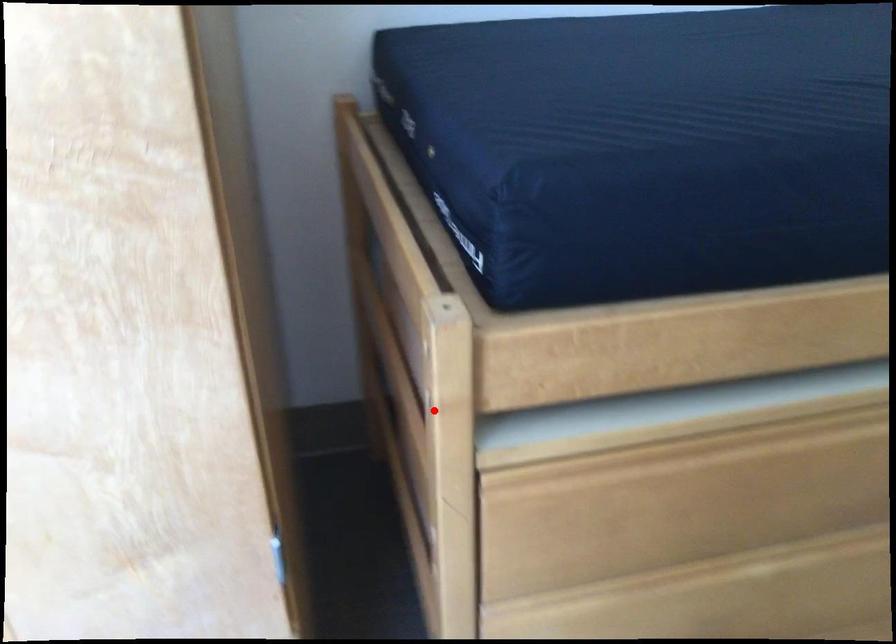
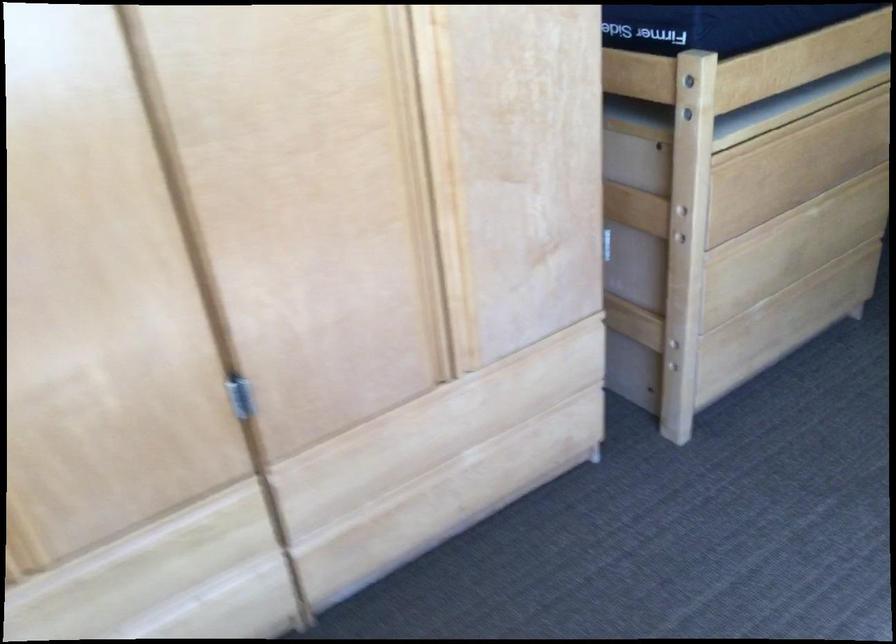
Question: A red point is marked in image1. In image2, is the corresponding 3D point closer to the camera or farther? Reply with the corresponding letter.

Choices:
 (A) The corresponding 3D point is closer.
 (B) The corresponding 3D point is farther.

Answer: (B)